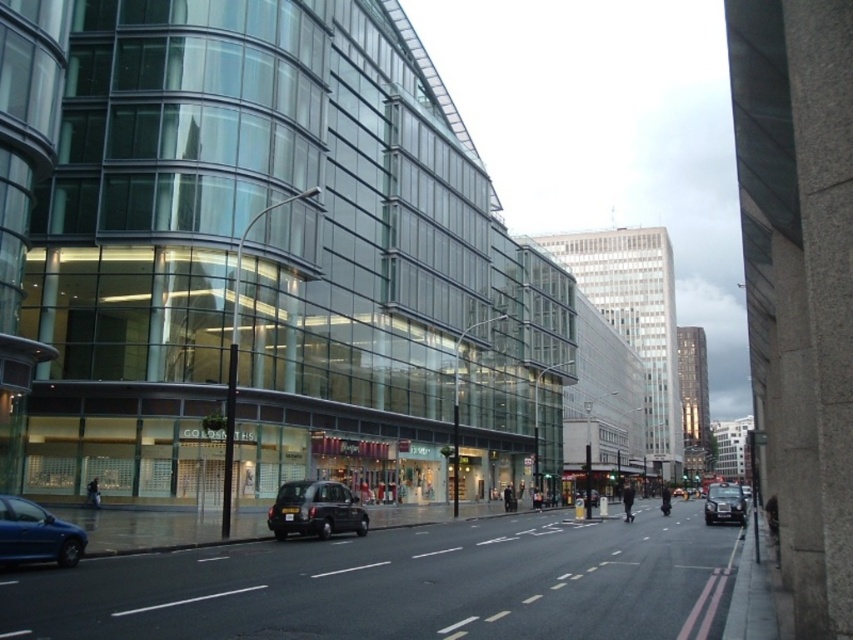
Can you confirm if metallic blue car at lower left is positioned to the right of black metallic car at center?

In fact, metallic blue car at lower left is to the left of black metallic car at center.

Does metallic blue car at lower left have a smaller size compared to black metallic car at center?

Correct, metallic blue car at lower left occupies less space than black metallic car at center.

Find the location of a particular element. metallic blue car at lower left is located at coordinates (36, 534).

Identify the location of metallic blue car at lower left. This screenshot has height=640, width=853. (36, 534).

Is point (296, 502) in front of point (733, 499)?

That is True.

The image size is (853, 640). Describe the element at coordinates (315, 509) in the screenshot. I see `black matte taxi at center` at that location.

Find the location of a particular element. This screenshot has height=640, width=853. black matte taxi at center is located at coordinates (315, 509).

Is black matte taxi at center positioned in front of metallic blue car at lower left?

No.

Can you confirm if black matte taxi at center is thinner than metallic blue car at lower left?

No, black matte taxi at center is not thinner than metallic blue car at lower left.

This screenshot has height=640, width=853. I want to click on black matte taxi at center, so click(x=315, y=509).

The height and width of the screenshot is (640, 853). Identify the location of black matte taxi at center. (315, 509).